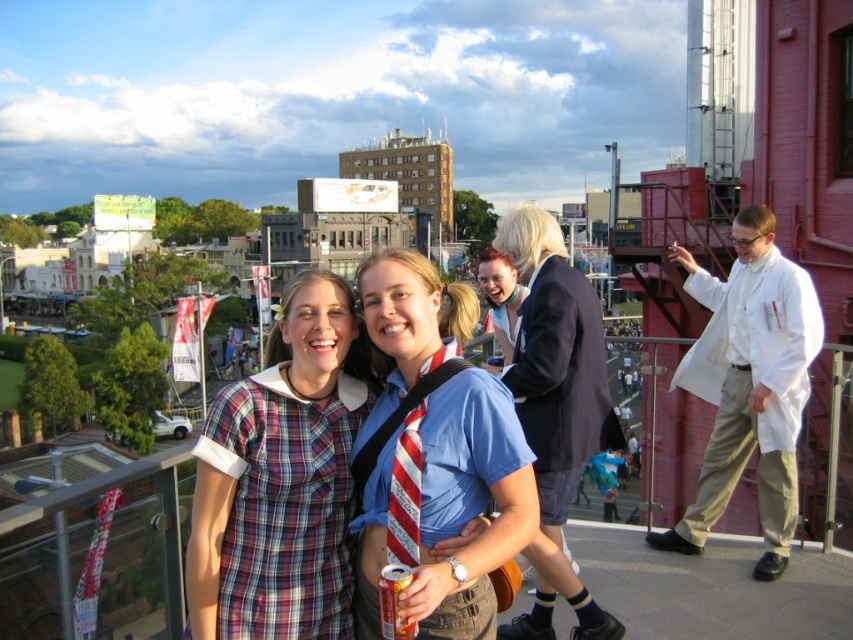
You are taking a photo of the blue fabric shirt at center and the white lab coat at right. Which one would appear larger in the photo?

The blue fabric shirt at center would appear larger in the photo because it is closer to the viewer than the white lab coat at right.

You are standing at the center of the rooftop scene. There is a blue fabric shirt at center. Can you tell me what is located at the point with coordinates (434, 458)?

The point at coordinates (434, 458) has the blue fabric shirt at center located there.